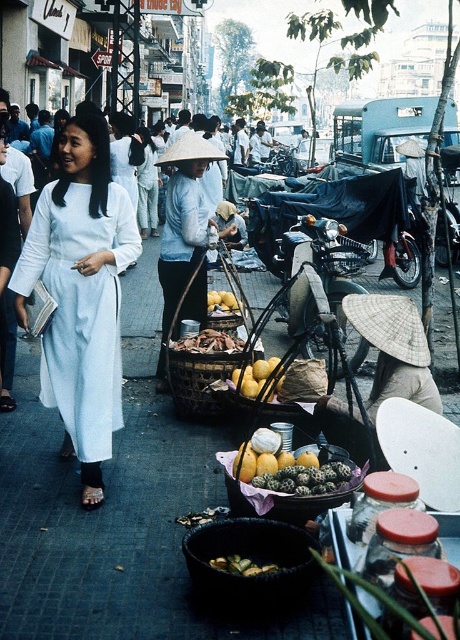
Does matte straw hat at center have a lesser width compared to brown textured fish at center?

In fact, matte straw hat at center might be wider than brown textured fish at center.

The width and height of the screenshot is (460, 640). I want to click on matte straw hat at center, so click(394, 353).

The image size is (460, 640). What are the coordinates of `matte straw hat at center` in the screenshot? It's located at (394, 353).

Who is more distant from viewer, (286, 548) or (226, 308)?

The point (226, 308) is behind.

Image resolution: width=460 pixels, height=640 pixels. Describe the element at coordinates (249, 561) in the screenshot. I see `black woven basket at lower center` at that location.

Is point (214, 540) more distant than point (224, 305)?

No, it is in front of (224, 305).

Where is `black woven basket at lower center`? The image size is (460, 640). black woven basket at lower center is located at coordinates (249, 561).

Who is more forward, (217, 355) or (231, 342)?

Point (217, 355) is more forward.

Does woven bamboo basket at center have a greater width compared to brown textured fish at center?

Incorrect, woven bamboo basket at center's width does not surpass brown textured fish at center's.

What do you see at coordinates (201, 380) in the screenshot? The width and height of the screenshot is (460, 640). I see `woven bamboo basket at center` at bounding box center [201, 380].

In order to click on woven bamboo basket at center in this screenshot , I will do `click(201, 380)`.